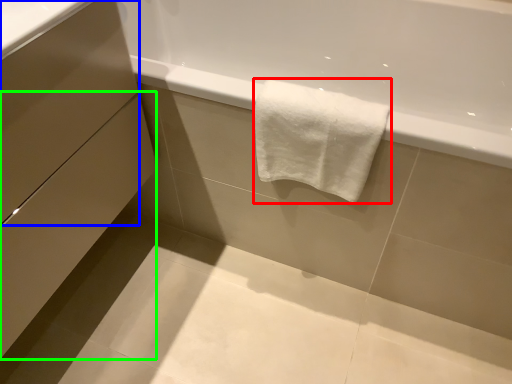
Question: Estimate the real-world distances between objects in this image. Which object is farther from towel (highlighted by a red box), drawer (highlighted by a blue box) or drawer (highlighted by a green box)?

Choices:
 (A) drawer
 (B) drawer

Answer: (B)